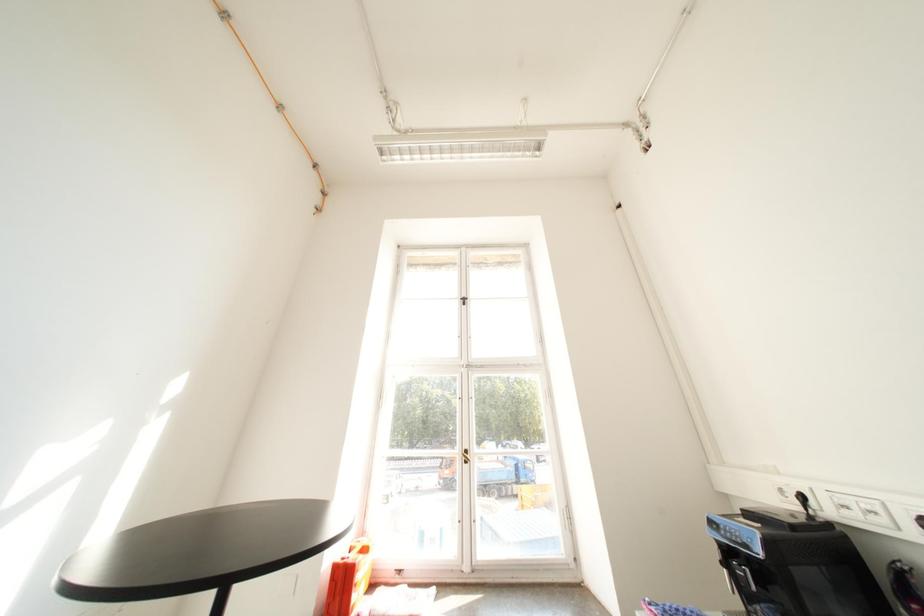
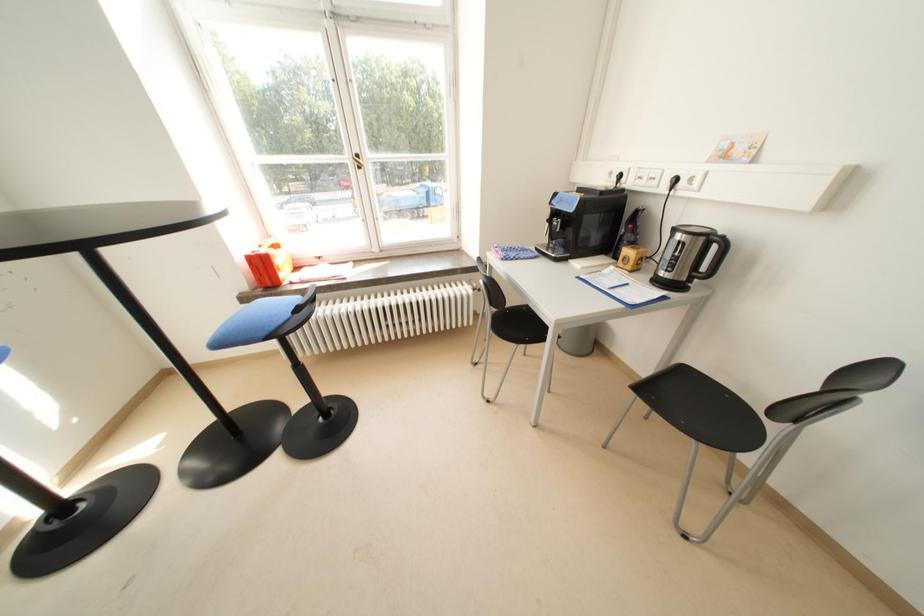
The first image is from the beginning of the video and the second image is from the end. How did the camera likely rotate when shooting the video?

The camera rotated toward right-down.